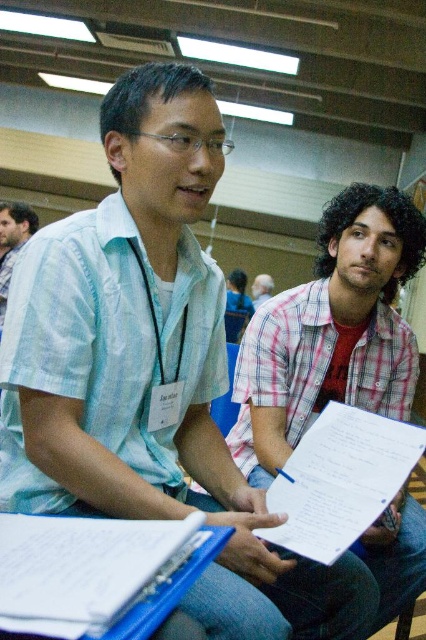
Looking at this image, you are standing in the room and want to find the pink checkered shirt at center. According to the coordinates provided, where should you look relative to the room?

The pink checkered shirt at center is located at coordinates point 0.519 on the x axis and 0.779 on the y axis, so you should look towards the center of the room slightly to the right and lower middle area.

You are a photographer at the event and want to take a closeup photo of the white paper at center. The camera you have can focus on objects within 36 inches. Can you take the photo without moving closer?

The individuals are 35.91 inches apart, so yes, the photographer can take the photo without moving closer since the distance is within the camera focus range.

You are organizing a photo shoot and need to ensure that all participants are visible in the frame. Given that the camera you are using has a limited focus range, which individual should you prioritize focusing on to ensure their clothing details are clear? Please refer to the pink checkered shirt at center and the light blue shirt at center in your answer.

The pink checkered shirt at center is bigger than the light blue shirt at center, so you should prioritize focusing on the pink checkered shirt at center to ensure its details are clear.